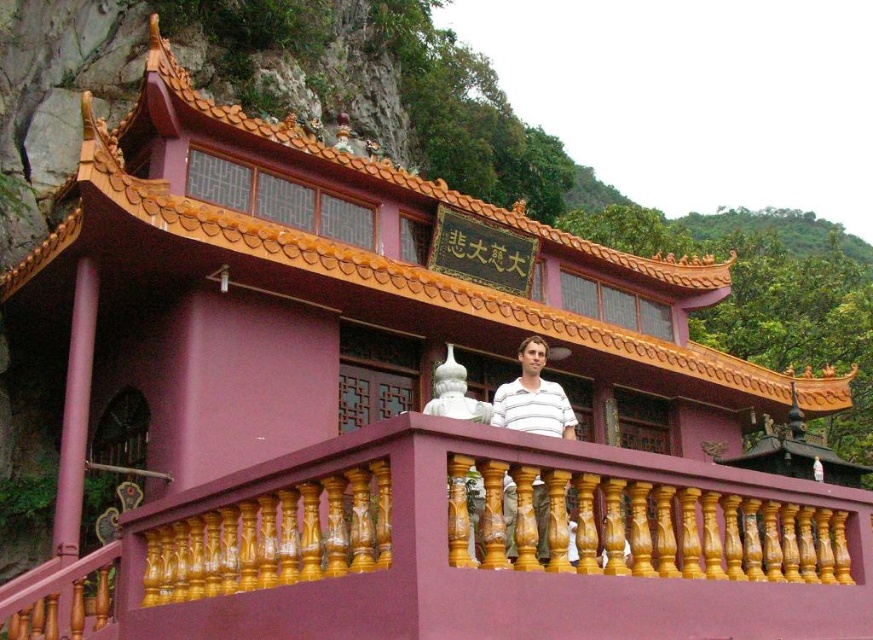
Who is more distant from viewer, (702, 611) or (546, 516)?

The point (546, 516) is more distant.

Between wooden at center and white striped shirt at center, which one has less height?

white striped shirt at center is shorter.

Does point (583, 636) come behind point (514, 506)?

That is False.

Locate an element on the screen. This screenshot has width=873, height=640. wooden at center is located at coordinates (468, 550).